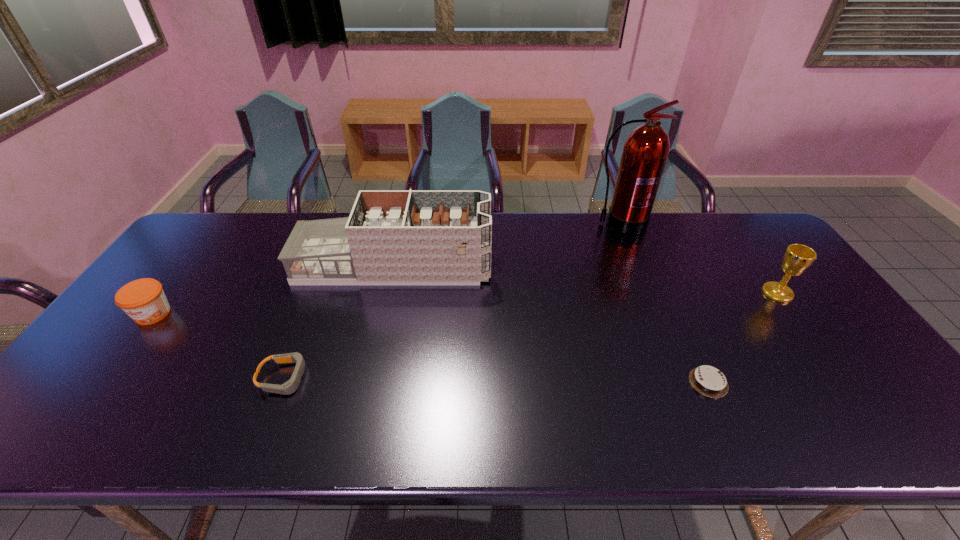
Identify the location of vacant space in between the tallest object and the goggles. (452, 301).

The width and height of the screenshot is (960, 540). I want to click on unoccupied area between the farthest object and the fifth tallest object, so click(452, 301).

Identify the location of unoccupied area between the dollhouse and the tallest object. Image resolution: width=960 pixels, height=540 pixels. (507, 245).

This screenshot has height=540, width=960. I want to click on free space between the fifth tallest object and the fire extinguisher, so click(452, 301).

You are a GUI agent. You are given a task and a screenshot of the screen. Output one action in this format:
    pyautogui.click(x=<x>, y=<y>)
    Task: Click on the object that stands as the second closest to the fourth shortest object
    This screenshot has height=540, width=960.
    Given the screenshot: What is the action you would take?
    pyautogui.click(x=646, y=150)

Identify the location of the fourth closest object to the chocolate cake. (289, 387).

Identify the location of free spot that satisfies the following two spatial constraints: 1. on the front and back of the goggles; 2. on the back side of the chocolate cake. (283, 382).

The image size is (960, 540). What are the coordinates of `vacant space that satisfies the following two spatial constraints: 1. on the front-facing side of the farthest object; 2. at the entrance of the second tallest object` in the screenshot? It's located at (636, 266).

Image resolution: width=960 pixels, height=540 pixels. Identify the location of vacant space that satisfies the following two spatial constraints: 1. on the front-facing side of the chocolate cake; 2. on the right side of the tallest object. (683, 382).

Where is `free location that satisfies the following two spatial constraints: 1. on the back side of the shortest object; 2. at the entrance of the dollhouse`? The image size is (960, 540). free location that satisfies the following two spatial constraints: 1. on the back side of the shortest object; 2. at the entrance of the dollhouse is located at coordinates (656, 266).